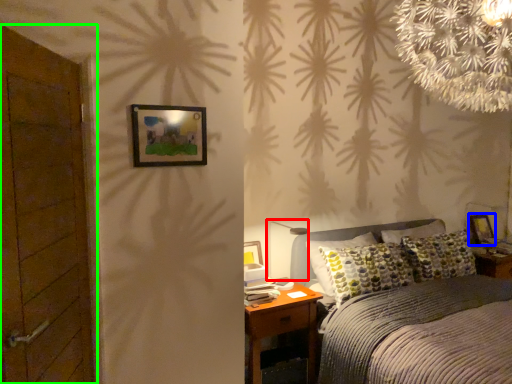
Question: Estimate the real-world distances between objects in this image. Which object is farther from table lamp (highlighted by a red box), picture frame (highlighted by a blue box) or door (highlighted by a green box)?

Choices:
 (A) picture frame
 (B) door

Answer: (A)